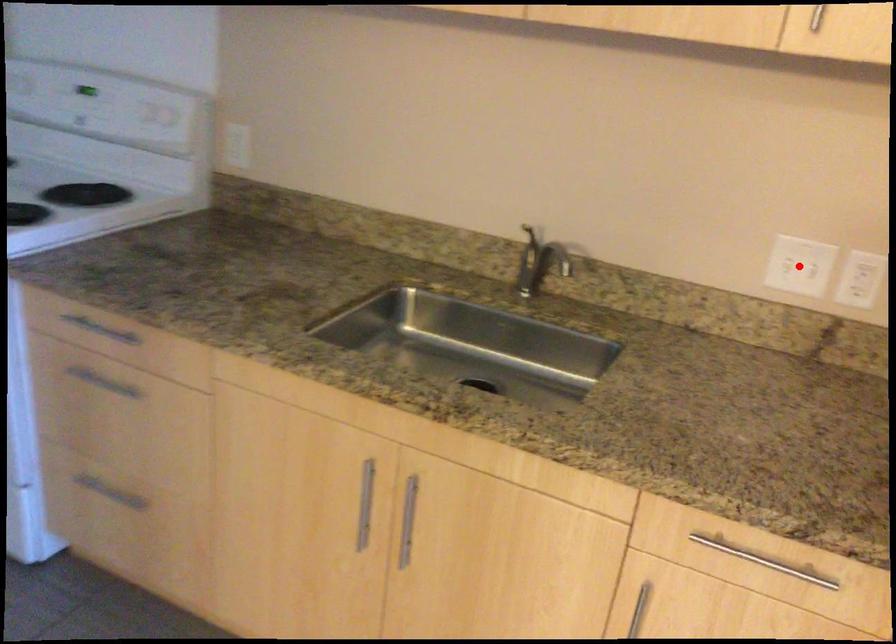
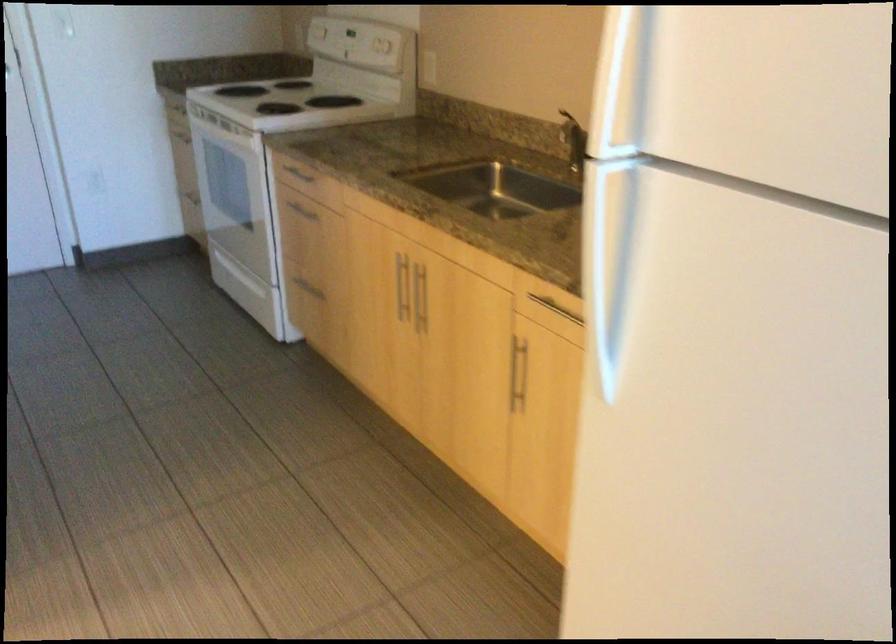
Question: I am providing you with two images of the same scene from different viewpoints. A red point is marked on the first image. At the location where the point appears in image 1, is it still visible in image 2?

Choices:
 (A) Yes
 (B) No

Answer: (B)